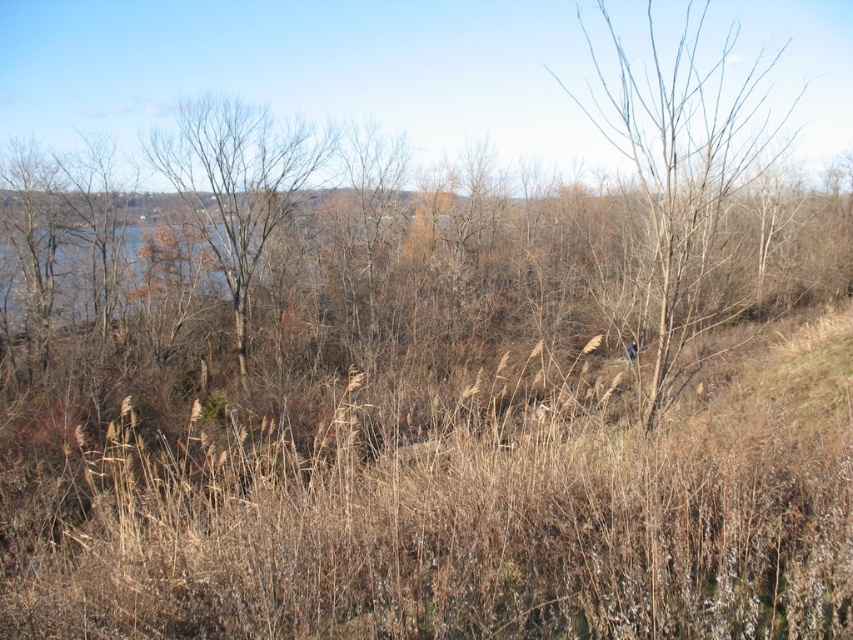
Is bare branches at center wider than bare branches at left?

Yes, bare branches at center is wider than bare branches at left.

Can you confirm if bare branches at center is positioned above bare branches at left?

Indeed, bare branches at center is positioned over bare branches at left.

Between point (663, 266) and point (293, 198), which one is positioned in front?

Point (663, 266) is in front.

Find the location of a particular element. Image resolution: width=853 pixels, height=640 pixels. bare branches at center is located at coordinates (685, 164).